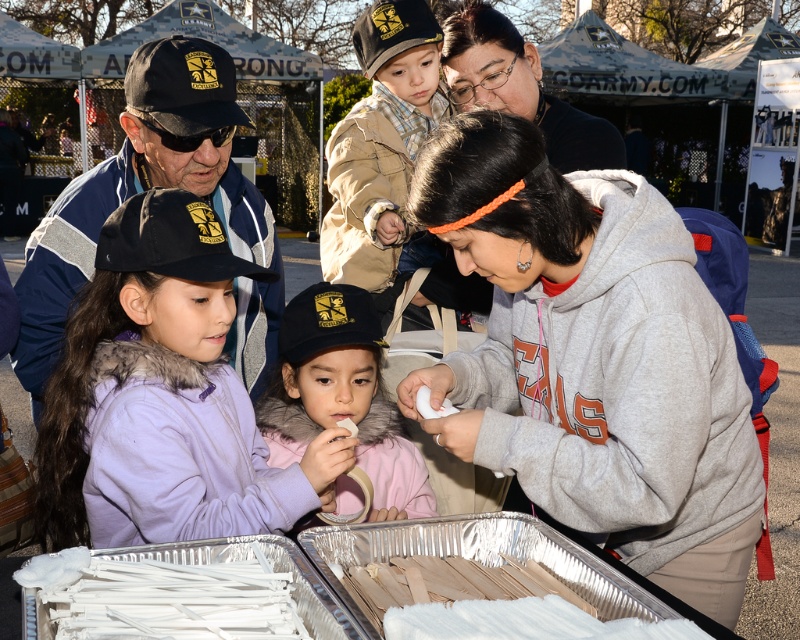
Is white plastic straws at lower center in front of matte black hoodie at upper center?

That is True.

This screenshot has width=800, height=640. I want to click on white plastic straws at lower center, so click(x=164, y=596).

Can you confirm if black matte cap at upper left is shorter than pink fleece jacket at center?

Incorrect, black matte cap at upper left's height does not fall short of pink fleece jacket at center's.

Is point (244, 208) farther from camera compared to point (392, 419)?

Yes.

Which is behind, point (160, 134) or point (308, 442)?

Point (160, 134)

What are the coordinates of `black matte cap at upper left` in the screenshot? It's located at (152, 188).

Does gray fleece hoodie at center appear over black matte cap at upper left?

No, gray fleece hoodie at center is not above black matte cap at upper left.

In the scene shown: Who is positioned more to the right, gray fleece hoodie at center or black matte cap at upper left?

gray fleece hoodie at center is more to the right.

Locate an element on the screen. This screenshot has width=800, height=640. gray fleece hoodie at center is located at coordinates (594, 358).

Locate an element on the screen. This screenshot has height=640, width=800. gray fleece hoodie at center is located at coordinates (594, 358).